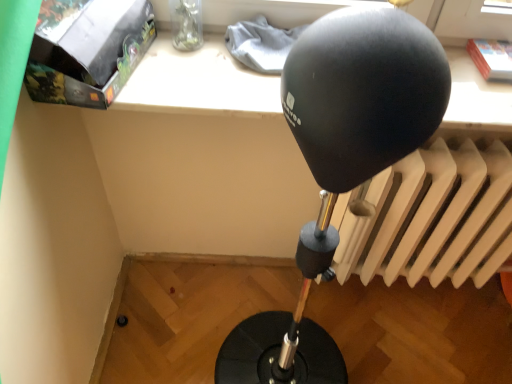
This screenshot has width=512, height=384. What are the coordinates of `matte black box at upper left` in the screenshot? It's located at (87, 50).

What is the approximate height of matte black box at upper left?

It is 8.20 inches.

What do you see at coordinates (87, 50) in the screenshot?
I see `matte black box at upper left` at bounding box center [87, 50].

From the picture: Measure the distance between point (482,260) and camera.

A distance of 4.45 feet exists between point (482,260) and camera.

What do you see at coordinates (431, 217) in the screenshot?
I see `white matte radiator at right` at bounding box center [431, 217].

Identify the location of white matte radiator at right. The width and height of the screenshot is (512, 384). (431, 217).

Locate an element on the screen. Image resolution: width=512 pixels, height=384 pixels. matte black box at upper left is located at coordinates click(87, 50).

Based on the photo, does matte black box at upper left appear on the right side of white matte radiator at right?

No.

Considering their positions, is matte black box at upper left located in front of or behind white matte radiator at right?

In the image, matte black box at upper left appears in front of white matte radiator at right.

Does point (91, 17) come behind point (404, 248)?

No, it is in front of (404, 248).

From the image's perspective, which one is positioned higher, matte black box at upper left or white matte radiator at right?

From the image's view, matte black box at upper left is above.

From a real-world perspective, who is located lower, matte black box at upper left or white matte radiator at right?

white matte radiator at right is physically lower.

Is matte black box at upper left wider than white matte radiator at right?

Correct, the width of matte black box at upper left exceeds that of white matte radiator at right.

Considering the sizes of objects matte black box at upper left and white matte radiator at right in the image provided, who is shorter, matte black box at upper left or white matte radiator at right?

matte black box at upper left.

Considering the relative sizes of matte black box at upper left and white matte radiator at right in the image provided, is matte black box at upper left bigger than white matte radiator at right?

No, matte black box at upper left is not bigger than white matte radiator at right.

Would you say matte black box at upper left is outside white matte radiator at right?

matte black box at upper left lies outside white matte radiator at right's area.

Are matte black box at upper left and white matte radiator at right far apart?

No, matte black box at upper left is in close proximity to white matte radiator at right.

Is matte black box at upper left oriented away from white matte radiator at right?

No, matte black box at upper left's orientation is not away from white matte radiator at right.

How many degrees apart are the facing directions of matte black box at upper left and white matte radiator at right?

The facing directions of matte black box at upper left and white matte radiator at right are 5.65 degrees apart.

The image size is (512, 384). I want to click on radiator behind the matte black box at upper left, so click(x=431, y=217).

Which object is positioned more to the left, white matte radiator at right or matte black box at upper left?

Positioned to the left is matte black box at upper left.

Does white matte radiator at right come in front of matte black box at upper left?

No.

Is point (454, 247) positioned behind point (76, 93)?

Yes, point (454, 247) is behind point (76, 93).

From the image's perspective, is white matte radiator at right located beneath matte black box at upper left?

Yes, from the image's perspective, white matte radiator at right is beneath matte black box at upper left.

From a real-world perspective, which is physically above, white matte radiator at right or matte black box at upper left?

matte black box at upper left.

Can you confirm if white matte radiator at right is wider than matte black box at upper left?

No, white matte radiator at right is not wider than matte black box at upper left.

Is white matte radiator at right taller or shorter than matte black box at upper left?

In the image, white matte radiator at right appears to be taller than matte black box at upper left.

Is white matte radiator at right bigger than matte black box at upper left?

Correct, white matte radiator at right is larger in size than matte black box at upper left.

Choose the correct answer: Is white matte radiator at right inside matte black box at upper left or outside it?

white matte radiator at right exists outside the volume of matte black box at upper left.

Is white matte radiator at right beside matte black box at upper left?

No, white matte radiator at right is not touching matte black box at upper left.

Could you tell me if white matte radiator at right is facing matte black box at upper left?

No, white matte radiator at right is not aimed at matte black box at upper left.

The height and width of the screenshot is (384, 512). Identify the location of radiator on the right of matte black box at upper left. (431, 217).

Image resolution: width=512 pixels, height=384 pixels. In order to click on radiator that is under the matte black box at upper left (from a real-world perspective) in this screenshot , I will do `click(431, 217)`.

Identify the location of package that appears on the left of white matte radiator at right. The height and width of the screenshot is (384, 512). (87, 50).